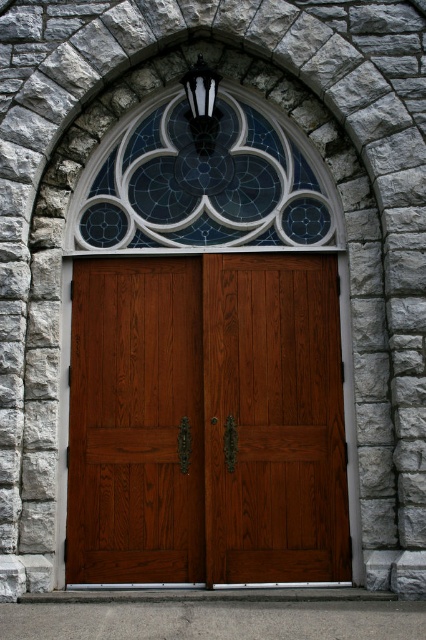
Which is behind, point (226, 397) or point (216, 138)?

Point (216, 138)

Can you confirm if satin wood doors at center is smaller than stained glass window at upper center?

Incorrect, satin wood doors at center is not smaller in size than stained glass window at upper center.

Measure the distance between point [178,506] and camera.

Point [178,506] is 9.46 meters away from camera.

Locate an element on the screen. Image resolution: width=426 pixels, height=640 pixels. satin wood doors at center is located at coordinates (207, 420).